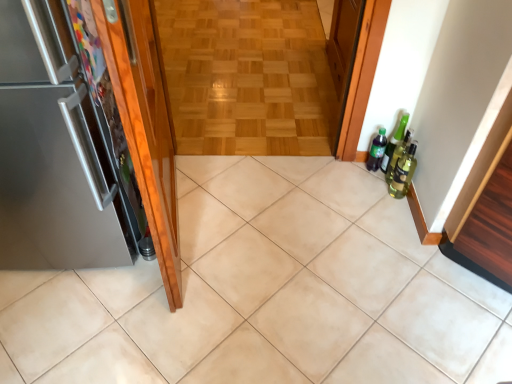
Question: Should I look upward or downward to see wooden parquet floor at center?

Choices:
 (A) up
 (B) down

Answer: (A)

Question: Is beige ceramic tile at center taller than green matte bottle at right?

Choices:
 (A) yes
 (B) no

Answer: (B)

Question: Can you confirm if beige ceramic tile at center is smaller than green matte bottle at right?

Choices:
 (A) no
 (B) yes

Answer: (A)

Question: From the image's perspective, is beige ceramic tile at center under green matte bottle at right?

Choices:
 (A) no
 (B) yes

Answer: (B)

Question: Can green matte bottle at right be found inside beige ceramic tile at center?

Choices:
 (A) no
 (B) yes

Answer: (A)

Question: Is beige ceramic tile at center facing away from green matte bottle at right?

Choices:
 (A) yes
 (B) no

Answer: (B)

Question: From a real-world perspective, is beige ceramic tile at center below green matte bottle at right?

Choices:
 (A) no
 (B) yes

Answer: (B)

Question: Are wooden parquet floor at center and wooden cabinet at right making contact?

Choices:
 (A) no
 (B) yes

Answer: (A)

Question: Is wooden parquet floor at center not within wooden cabinet at right?

Choices:
 (A) no
 (B) yes

Answer: (B)

Question: Does wooden parquet floor at center appear on the left side of wooden cabinet at right?

Choices:
 (A) no
 (B) yes

Answer: (B)

Question: Is wooden cabinet at right located within wooden parquet floor at center?

Choices:
 (A) no
 (B) yes

Answer: (A)

Question: Considering the relative sizes of wooden parquet floor at center and wooden cabinet at right in the image provided, is wooden parquet floor at center taller than wooden cabinet at right?

Choices:
 (A) no
 (B) yes

Answer: (A)

Question: Is wooden parquet floor at center shorter than wooden cabinet at right?

Choices:
 (A) yes
 (B) no

Answer: (A)

Question: Is the depth of green glass bottle at right, which ranks as the 2th beer bottle in back-to-front order, less than that of beige ceramic tile at center?

Choices:
 (A) yes
 (B) no

Answer: (B)